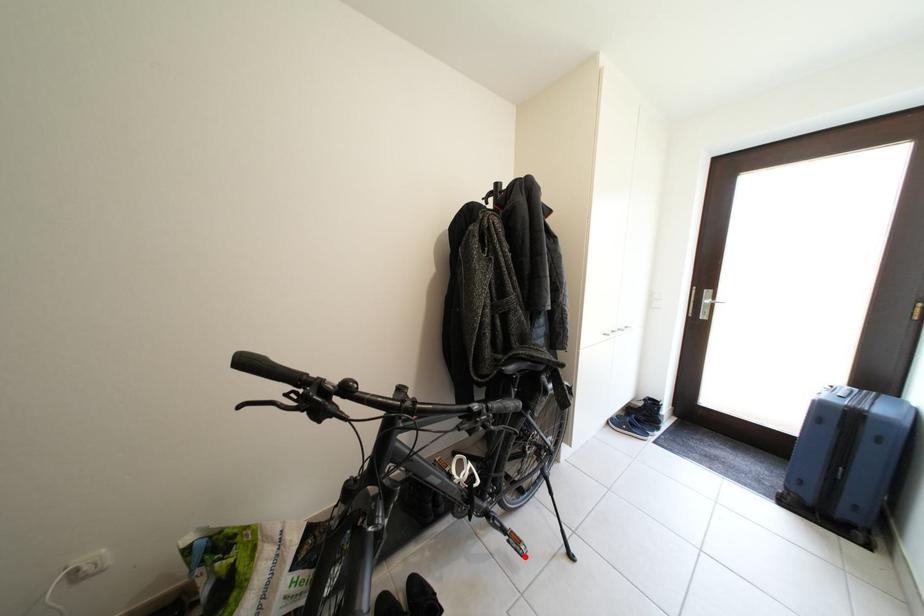
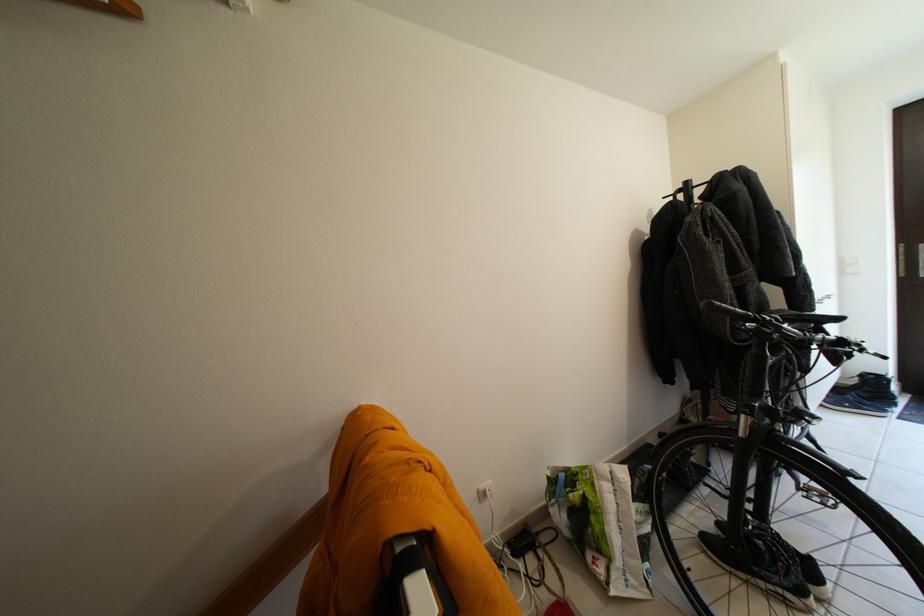
Question: I am providing you with two images of the same scene from different viewpoints. Given a red point in image1, look at the same physical point in image2. Is it:

Choices:
 (A) Closer to the viewpoint
 (B) Farther from the viewpoint

Answer: (A)